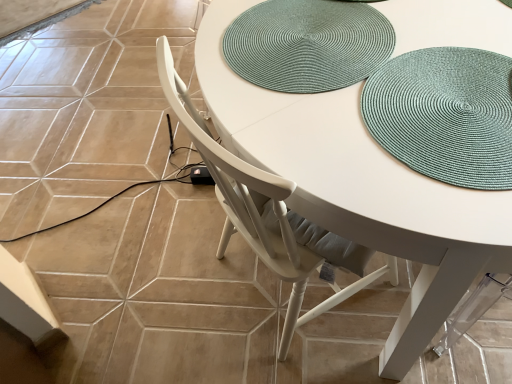
The height and width of the screenshot is (384, 512). I want to click on free space behind teal woven placemat at upper right, so tap(393, 28).